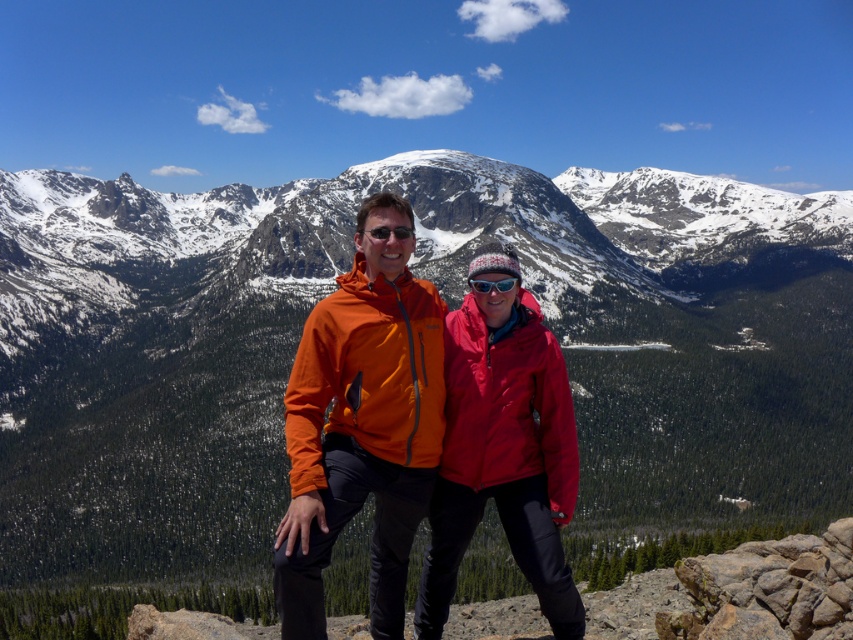
Question: Is snowy granite mountain at center positioned at the back of matte black goggles at center?

Choices:
 (A) yes
 (B) no

Answer: (A)

Question: Considering the real-world distances, which object is farthest from the snowy granite mountain at center?

Choices:
 (A) matte red jacket at center
 (B) orange softshell jacket at center

Answer: (A)

Question: Observing the image, what is the correct spatial positioning of snowy granite mountain at center in reference to matte black goggles at center?

Choices:
 (A) left
 (B) right

Answer: (A)

Question: Is matte red jacket at center below matte black goggles at center?

Choices:
 (A) yes
 (B) no

Answer: (B)

Question: Based on their relative distances, which object is nearer to the orange softshell jacket at center?

Choices:
 (A) matte red jacket at center
 (B) snowy granite mountain at center
 (C) matte black goggles at center

Answer: (A)

Question: Which point is closer to the camera?

Choices:
 (A) (491, 480)
 (B) (471, 280)
 (C) (376, 515)

Answer: (C)